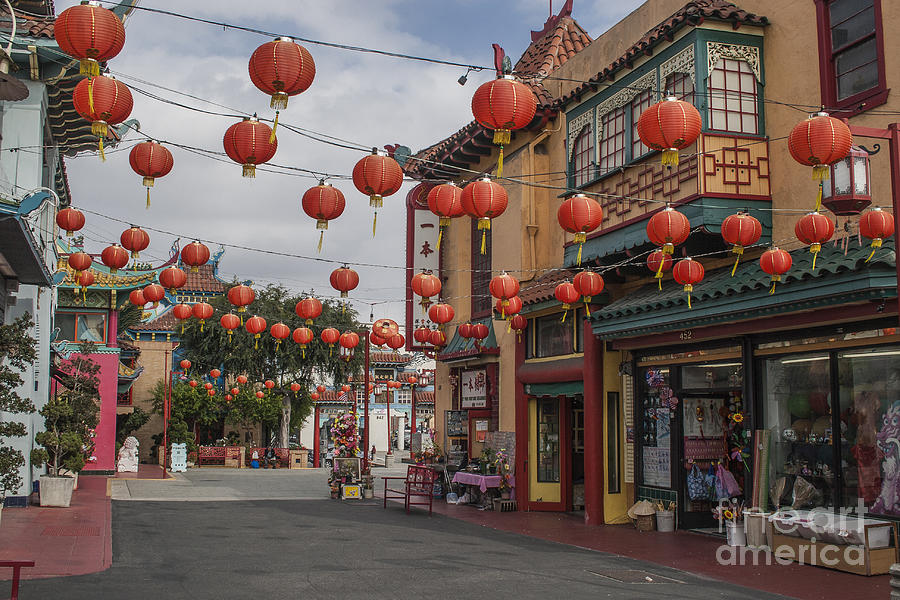
The image size is (900, 600). Find the location of `bench`. bench is located at coordinates (398, 477).